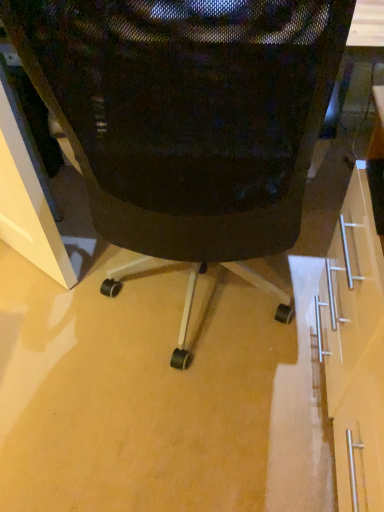
Question: Should I look upward or downward to see black mesh chair at center?

Choices:
 (A) down
 (B) up

Answer: (B)